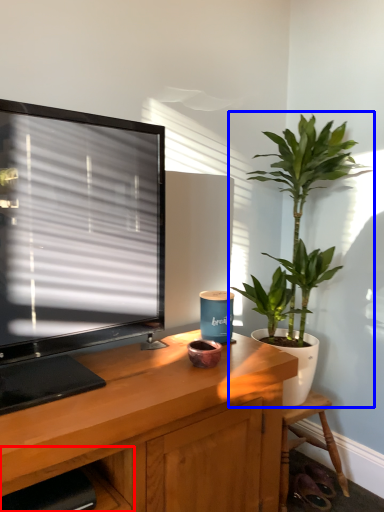
Question: Which point is closer to the camera, shelf (highlighted by a red box) or houseplant (highlighted by a blue box)?

Choices:
 (A) shelf
 (B) houseplant

Answer: (A)